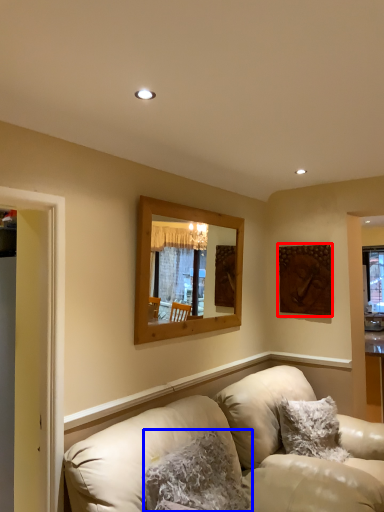
Question: Which point is further to the camera, picture frame (highlighted by a red box) or pillow (highlighted by a blue box)?

Choices:
 (A) picture frame
 (B) pillow

Answer: (A)